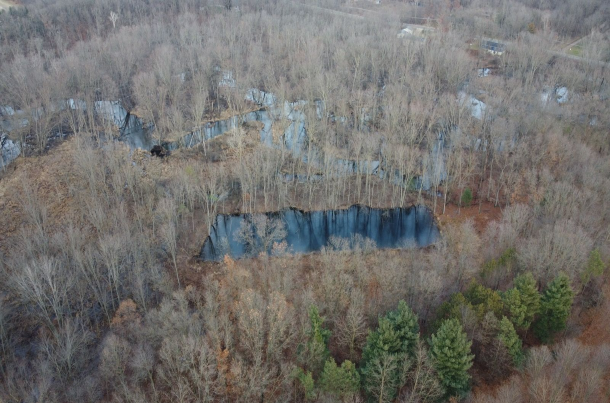
This screenshot has width=610, height=404. I want to click on corners, so click(608, 400), click(1, 398), click(608, 0), click(1, 2).